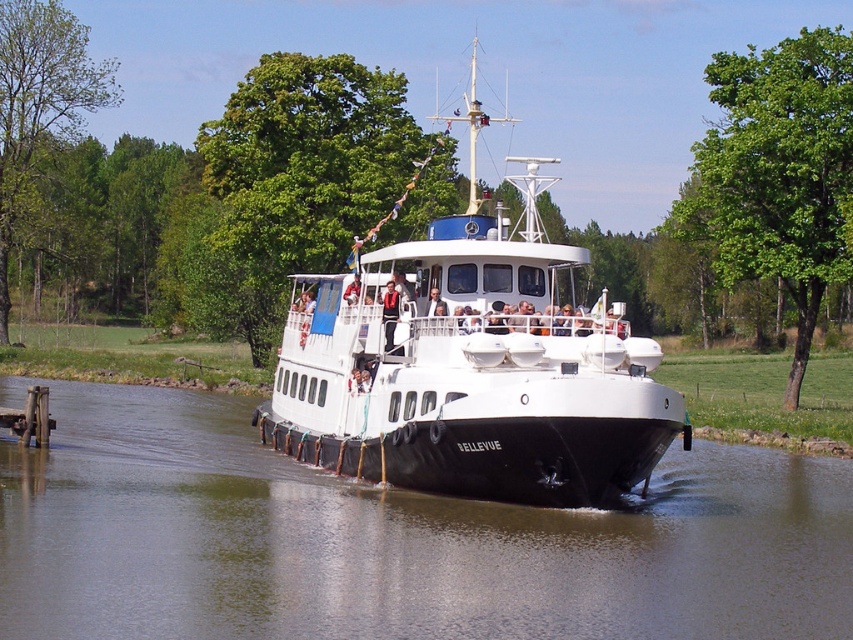
Is point (401, 497) closer to viewer compared to point (445, 486)?

No, it is behind (445, 486).

Does black rubber boat at center appear over white matte boat at center?

No.

Is point (450, 538) less distant than point (461, 380)?

Yes, it is in front of point (461, 380).

What are the coordinates of `black rubber boat at center` in the screenshot? It's located at (393, 540).

Between white matte boat at center and wooden planks at lower left, which one is positioned higher?

white matte boat at center is above.

Does white matte boat at center come behind wooden planks at lower left?

No, white matte boat at center is in front of wooden planks at lower left.

At what (x,y) coordinates should I click in order to perform the action: click on white matte boat at center. Please return your answer as a coordinate pair (x, y). Image resolution: width=853 pixels, height=640 pixels. Looking at the image, I should click on (469, 365).

Is black rubber boat at center thinner than wooden planks at lower left?

Incorrect, black rubber boat at center's width is not less than wooden planks at lower left's.

Is black rubber boat at center positioned behind wooden planks at lower left?

No, black rubber boat at center is in front of wooden planks at lower left.

Who is more distant from viewer, (625, 560) or (45, 436)?

Positioned behind is point (45, 436).

Locate an element on the screen. This screenshot has width=853, height=640. black rubber boat at center is located at coordinates (393, 540).